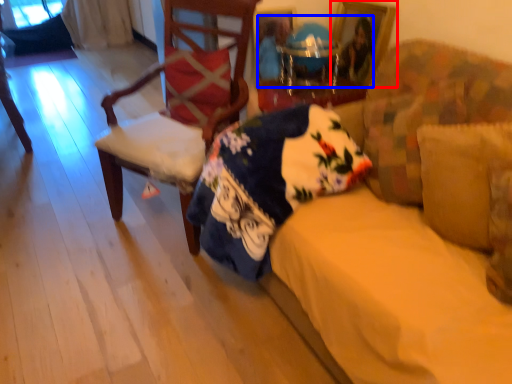
Question: Which object is further to the camera taking this photo, picture frame (highlighted by a red box) or couple (highlighted by a blue box)?

Choices:
 (A) picture frame
 (B) couple

Answer: (A)